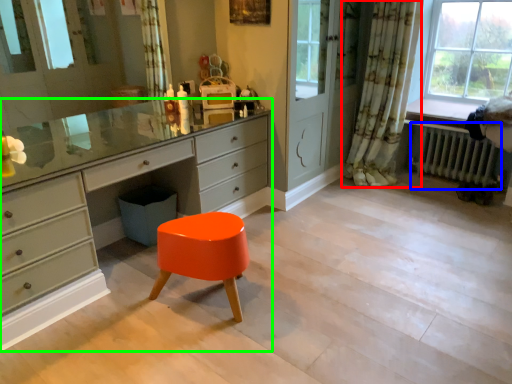
Question: Which is nearer to the curtain (highlighted by a red box)? radiator (highlighted by a blue box) or chest of drawers (highlighted by a green box).

Choices:
 (A) radiator
 (B) chest of drawers

Answer: (A)